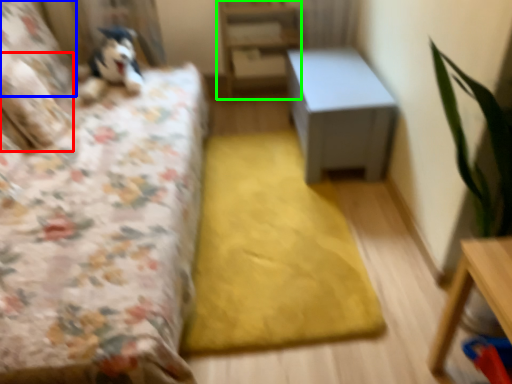
Question: Considering the real-world distances, which object is farthest from pillow (highlighted by a red box)? pillow (highlighted by a blue box) or bookshelf (highlighted by a green box)?

Choices:
 (A) pillow
 (B) bookshelf

Answer: (B)